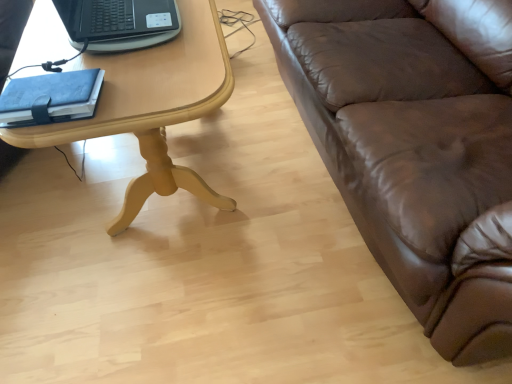
Image resolution: width=512 pixels, height=384 pixels. Find the location of `free area behind blue leather notebook at left`. free area behind blue leather notebook at left is located at coordinates (85, 63).